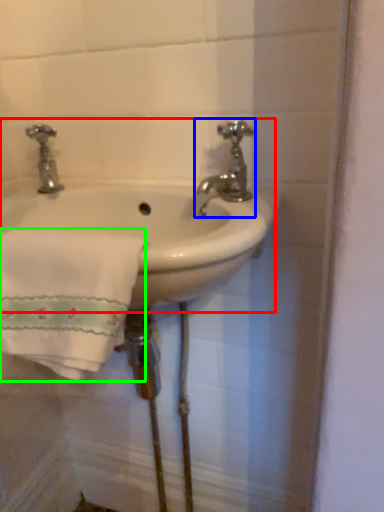
Question: Which is nearer to the sink (highlighted by a red box)? tap (highlighted by a blue box) or bath towel (highlighted by a green box).

Choices:
 (A) tap
 (B) bath towel

Answer: (A)